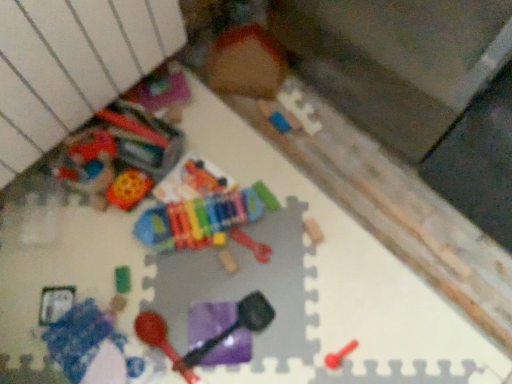
Identify the location of rubber bone at center, the 2th toy viewed from the right. (251, 245).

What do you see at coordinates (207, 221) in the screenshot? I see `multicolored plastic xylophone at center, the fifth toy from the right` at bounding box center [207, 221].

Find the location of a particular element. This screenshot has height=384, width=512. rubberized plastic maraca at lower center, arranged as the 6th toy when viewed from the right is located at coordinates (161, 341).

Is purple matte shovel at center, which is the fifth toy in left-to-right order, taller than blue fabric blanket at lower left, which ranks as the 7th toy in right-to-left order?

No, purple matte shovel at center, which is the fifth toy in left-to-right order, is not taller than blue fabric blanket at lower left, which ranks as the 7th toy in right-to-left order.

Measure the distance between purple matte shovel at center, the third toy positioned from the right, and blue fabric blanket at lower left, positioned as the first toy in left-to-right order.

9.61 inches.

From the image's perspective, which object appears higher, purple matte shovel at center, the third toy positioned from the right, or blue fabric blanket at lower left, which ranks as the 7th toy in right-to-left order?

purple matte shovel at center, the third toy positioned from the right, is shown above in the image.

Is rubber bone at center, the 6th toy when ordered from left to right, at the left side of purple matte shovel at center, the third toy positioned from the right?

In fact, rubber bone at center, the 6th toy when ordered from left to right, is to the right of purple matte shovel at center, the third toy positioned from the right.

How many degrees apart are the facing directions of rubber bone at center, the 6th toy when ordered from left to right, and purple matte shovel at center, which is the fifth toy in left-to-right order?

They differ by 15.3 degrees in their facing directions.

Is purple matte shovel at center, which is the fifth toy in left-to-right order, surrounded by rubber bone at center, the 2th toy viewed from the right?

No.

Is multicolored plastic xylophone at center, the third toy from the left, oriented away from smooth plastic spoon at lower right, arranged as the first toy when viewed from the right?

No, multicolored plastic xylophone at center, the third toy from the left,'s orientation is not away from smooth plastic spoon at lower right, arranged as the first toy when viewed from the right.

In the scene shown: From a real-world perspective, which is physically above, multicolored plastic xylophone at center, the fifth toy from the right, or smooth plastic spoon at lower right, the seventh toy in the left-to-right sequence?

multicolored plastic xylophone at center, the fifth toy from the right, from a real-world perspective.

You are a GUI agent. You are given a task and a screenshot of the screen. Output one action in this format:
    pyautogui.click(x=<x>, y=<y>)
    Task: Click on the toy that is the 4th one when counting downward from the multicolored plastic xylophone at center, the third toy from the left (from the image's perspective)
    
    Given the screenshot: What is the action you would take?
    pyautogui.click(x=339, y=355)

From the image's perspective, is rubberized plastic maraca at lower center, arranged as the 6th toy when viewed from the right, above rubber bone at center, the 2th toy viewed from the right?

No, from the image's perspective, rubberized plastic maraca at lower center, arranged as the 6th toy when viewed from the right, is not on top of rubber bone at center, the 2th toy viewed from the right.

Who is more distant, rubberized plastic maraca at lower center, which ranks as the 2th toy in left-to-right order, or rubber bone at center, the 6th toy when ordered from left to right?

rubber bone at center, the 6th toy when ordered from left to right.

Who is shorter, rubberized plastic maraca at lower center, arranged as the 6th toy when viewed from the right, or rubber bone at center, the 2th toy viewed from the right?

Standing shorter between the two is rubber bone at center, the 2th toy viewed from the right.

Does rubberized plastic maraca at lower center, which ranks as the 2th toy in left-to-right order, have a lesser width compared to rubber bone at center, the 2th toy viewed from the right?

No.

Is multicolored plastic xylophone at center, the third toy from the left, next to blue fabric blanket at lower left, which ranks as the 7th toy in right-to-left order, and touching it?

There is a gap between multicolored plastic xylophone at center, the third toy from the left, and blue fabric blanket at lower left, which ranks as the 7th toy in right-to-left order.

Is blue fabric blanket at lower left, which ranks as the 7th toy in right-to-left order, surrounded by multicolored plastic xylophone at center, the third toy from the left?

Definitely not — blue fabric blanket at lower left, which ranks as the 7th toy in right-to-left order, is not inside multicolored plastic xylophone at center, the third toy from the left.

Does point (206, 229) come farther from viewer compared to point (105, 375)?

Yes, it is behind point (105, 375).

Can you confirm if multicolored plastic xylophone at center, the third toy from the left, is taller than blue fabric blanket at lower left, positioned as the first toy in left-to-right order?

Correct, multicolored plastic xylophone at center, the third toy from the left, is much taller as blue fabric blanket at lower left, positioned as the first toy in left-to-right order.

Does point (101, 315) appear closer or farther from the camera than point (214, 238)?

Point (101, 315).

Between blue fabric blanket at lower left, which ranks as the 7th toy in right-to-left order, and multicolored plastic xylophone at center, the fifth toy from the right, which one has larger size?

Bigger between the two is multicolored plastic xylophone at center, the fifth toy from the right.

Does blue fabric blanket at lower left, which ranks as the 7th toy in right-to-left order, have a lesser height compared to multicolored plastic xylophone at center, the fifth toy from the right?

Correct, blue fabric blanket at lower left, which ranks as the 7th toy in right-to-left order, is not as tall as multicolored plastic xylophone at center, the fifth toy from the right.

From the blue fabric blanket at lower left, which ranks as the 7th toy in right-to-left order, count 3rd toys backward and point to it. Please provide its 2D coordinates.

[(207, 221)]

Can you confirm if purple matte shovel at center, which is the fifth toy in left-to-right order, is wider than wooden xylophone at center, which is the 4th toy from left to right?

Correct, the width of purple matte shovel at center, which is the fifth toy in left-to-right order, exceeds that of wooden xylophone at center, which is the 4th toy from left to right.

In order to click on the 1st toy above the purple matte shovel at center, which is the fifth toy in left-to-right order (from the image's perspective) in this screenshot , I will do `click(228, 260)`.

Is the position of purple matte shovel at center, which is the fifth toy in left-to-right order, more distant than that of wooden xylophone at center, which is the 4th toy from left to right?

No.

Does point (240, 313) come closer to viewer compared to point (237, 269)?

Yes, it is.

At what (x,y) coordinates should I click in order to perform the action: click on toy that is the 1st object located behind the blue fabric blanket at lower left, positioned as the first toy in left-to-right order. Please return your answer as a coordinate pair (x, y). Image resolution: width=512 pixels, height=384 pixels. Looking at the image, I should click on (234, 326).

From a real-world perspective, count 4th toys upward from the rubber bone at center, the 6th toy when ordered from left to right, and point to it. Please provide its 2D coordinates.

[(234, 326)]

Based on their spatial positions, is multicolored plastic xylophone at center, the third toy from the left, or rubberized plastic maraca at lower center, arranged as the 6th toy when viewed from the right, further from blue fabric blanket at lower left, positioned as the first toy in left-to-right order?

multicolored plastic xylophone at center, the third toy from the left, is positioned further to the anchor blue fabric blanket at lower left, positioned as the first toy in left-to-right order.

When comparing their distances from blue fabric blanket at lower left, positioned as the first toy in left-to-right order, does wooden xylophone at center, which is the 4th toy from left to right, or smooth plastic spoon at lower right, the seventh toy in the left-to-right sequence, seem further?

smooth plastic spoon at lower right, the seventh toy in the left-to-right sequence, is positioned further to the anchor blue fabric blanket at lower left, positioned as the first toy in left-to-right order.

Looking at the image, which one is located further to purple matte shovel at center, which is the fifth toy in left-to-right order, smooth plastic spoon at lower right, the seventh toy in the left-to-right sequence, or rubberized plastic maraca at lower center, arranged as the 6th toy when viewed from the right?

The object further to purple matte shovel at center, which is the fifth toy in left-to-right order, is smooth plastic spoon at lower right, the seventh toy in the left-to-right sequence.

Based on their spatial positions, is multicolored plastic xylophone at center, the third toy from the left, or smooth plastic spoon at lower right, the seventh toy in the left-to-right sequence, closer to wooden xylophone at center, which is the 4th toy from left to right?

multicolored plastic xylophone at center, the third toy from the left.

Looking at the image, which one is located closer to smooth plastic spoon at lower right, arranged as the first toy when viewed from the right, rubber bone at center, the 6th toy when ordered from left to right, or multicolored plastic xylophone at center, the third toy from the left?

rubber bone at center, the 6th toy when ordered from left to right, is positioned closer to the anchor smooth plastic spoon at lower right, arranged as the first toy when viewed from the right.

When comparing their distances from smooth plastic spoon at lower right, arranged as the first toy when viewed from the right, does rubber bone at center, the 6th toy when ordered from left to right, or blue fabric blanket at lower left, which ranks as the 7th toy in right-to-left order, seem closer?

rubber bone at center, the 6th toy when ordered from left to right, is closer to smooth plastic spoon at lower right, arranged as the first toy when viewed from the right.

Looking at the image, which one is located closer to rubber bone at center, the 6th toy when ordered from left to right, purple matte shovel at center, the third toy positioned from the right, or wooden xylophone at center, which ranks as the fourth toy in right-to-left order?

wooden xylophone at center, which ranks as the fourth toy in right-to-left order, is closer to rubber bone at center, the 6th toy when ordered from left to right.

Considering their positions, is wooden xylophone at center, which ranks as the fourth toy in right-to-left order, positioned further to multicolored plastic xylophone at center, the third toy from the left, than blue fabric blanket at lower left, positioned as the first toy in left-to-right order?

Among the two, blue fabric blanket at lower left, positioned as the first toy in left-to-right order, is located further to multicolored plastic xylophone at center, the third toy from the left.

Where is `toy that lies between rubber bone at center, the 2th toy viewed from the right, and purple matte shovel at center, the third toy positioned from the right, from top to bottom`? toy that lies between rubber bone at center, the 2th toy viewed from the right, and purple matte shovel at center, the third toy positioned from the right, from top to bottom is located at coordinates pyautogui.click(x=228, y=260).

You are a GUI agent. You are given a task and a screenshot of the screen. Output one action in this format:
    pyautogui.click(x=<x>, y=<y>)
    Task: Click on the toy between purple matte shovel at center, which is the fifth toy in left-to-right order, and smooth plastic spoon at lower right, arranged as the first toy when viewed from the right, from left to right
    The width and height of the screenshot is (512, 384).
    Given the screenshot: What is the action you would take?
    pyautogui.click(x=251, y=245)